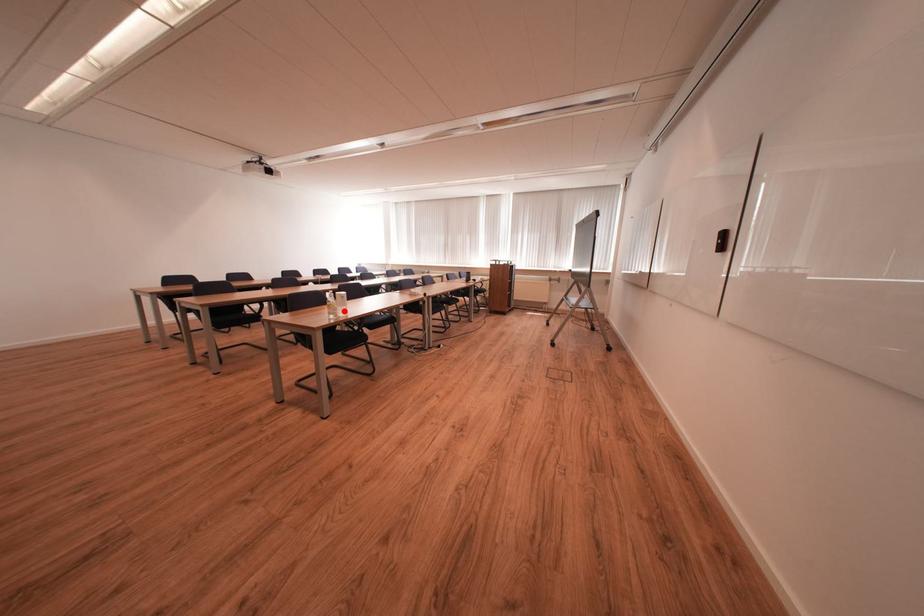
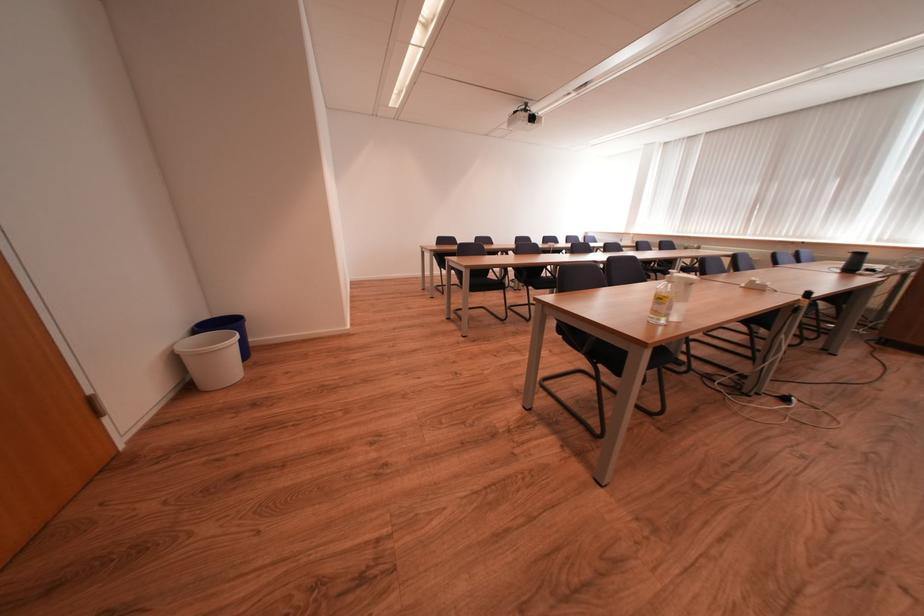
Question: A red point is marked in image1. In image2, is the corresponding 3D point closer to the camera or farther? Reply with the corresponding letter.

Choices:
 (A) The corresponding 3D point is closer.
 (B) The corresponding 3D point is farther.

Answer: (B)